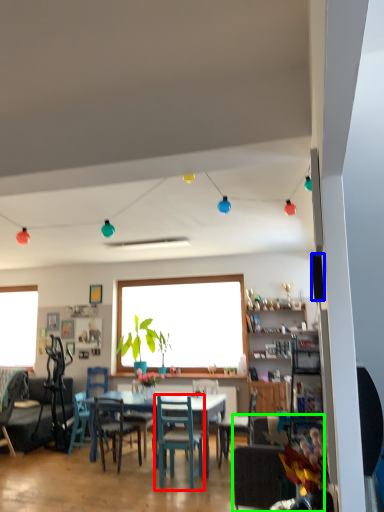
Question: Considering the real-world distances, which object is closest to chair (highlighted by a red box)? loudspeaker (highlighted by a blue box) or chair (highlighted by a green box).

Choices:
 (A) loudspeaker
 (B) chair

Answer: (B)